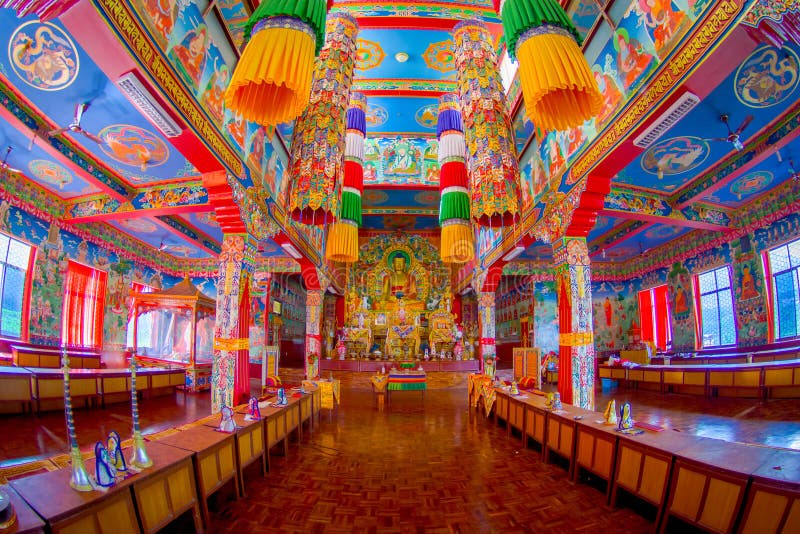
Find the location of a particular element. The height and width of the screenshot is (534, 800). paintings of circles on the ceiling is located at coordinates (141, 144), (38, 54), (361, 57), (438, 59), (673, 148), (758, 89), (750, 180), (658, 227), (378, 121), (432, 120).